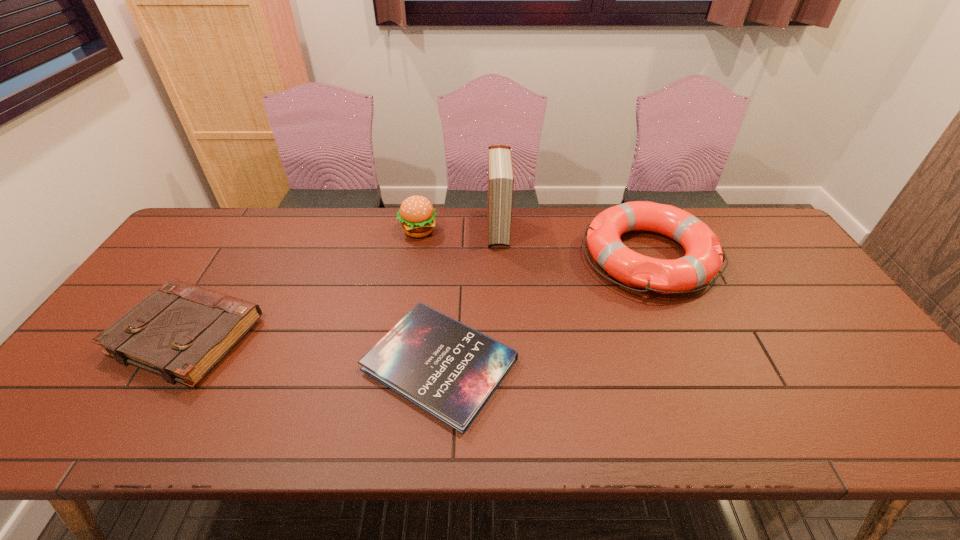
In the image, there is a desktop. Identify the location of free space at the left edge. (73, 387).

I want to click on vacant region at the far left corner, so click(x=218, y=238).

The image size is (960, 540). In order to click on free region at the near left corner in this screenshot , I will do `click(37, 417)`.

Locate an element on the screen. Image resolution: width=960 pixels, height=540 pixels. unoccupied area between the fourth tallest object and the shortest object is located at coordinates (314, 350).

You are a GUI agent. You are given a task and a screenshot of the screen. Output one action in this format:
    pyautogui.click(x=<x>, y=<y>)
    Task: Click on the vacant region between the fourth shortest object and the shortest hardback book
    Image resolution: width=960 pixels, height=540 pixels.
    Given the screenshot: What is the action you would take?
    pyautogui.click(x=429, y=298)

Find the location of a particular element. The width and height of the screenshot is (960, 540). empty location between the farthest hardback book and the shortest object is located at coordinates (468, 297).

The width and height of the screenshot is (960, 540). I want to click on free space between the leftmost object and the shortest hardback book, so click(x=314, y=350).

The height and width of the screenshot is (540, 960). Identify the location of vacant space that's between the rightmost object and the farthest hardback book. (573, 244).

This screenshot has height=540, width=960. Identify the location of free spot between the rightmost object and the leftmost hardback book. (418, 296).

Where is `free spot between the farthest hardback book and the leftmost hardback book`? The image size is (960, 540). free spot between the farthest hardback book and the leftmost hardback book is located at coordinates 343,283.